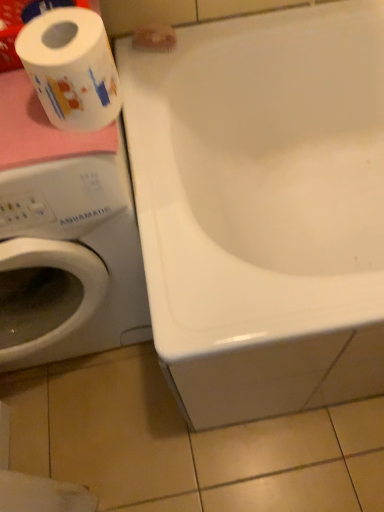
Find the location of a particular element. This screenshot has height=512, width=384. free space that is to the left of white printed toilet paper at left, which is counted as the second toilet paper, starting from the top is located at coordinates (x=19, y=119).